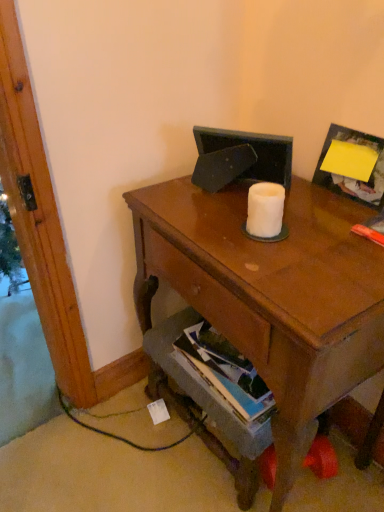
Find the location of a particular element. This screenshot has height=512, width=384. hardcover book at lower center is located at coordinates (227, 377).

Where is `yellow paper at upper right`? yellow paper at upper right is located at coordinates (352, 179).

Find the location of a particular element. The height and width of the screenshot is (512, 384). white matte toilet paper at center is located at coordinates (265, 210).

Does white matte toilet paper at center appear on the right side of hardcover book at lower center?

Correct, you'll find white matte toilet paper at center to the right of hardcover book at lower center.

Is white matte toilet paper at center taller or shorter than hardcover book at lower center?

In the image, white matte toilet paper at center appears to be shorter than hardcover book at lower center.

Is white matte toilet paper at center oriented away from hardcover book at lower center?

No, hardcover book at lower center is not at the back of white matte toilet paper at center.

From a real-world perspective, is hardcover book at lower center positioned under white matte toilet paper at center based on gravity?

Indeed, from a real-world perspective, hardcover book at lower center is positioned beneath white matte toilet paper at center.

Which object is positioned more to the left, hardcover book at lower center or white matte toilet paper at center?

hardcover book at lower center is more to the left.

Is point (246, 418) positioned before point (280, 211)?

No, it is not.

Are hardcover book at lower center and white matte toilet paper at center beside each other?

No, hardcover book at lower center is not in contact with white matte toilet paper at center.

Is yellow paper at upper right further to the viewer compared to hardcover book at lower center?

No, it is not.

Between yellow paper at upper right and hardcover book at lower center, which one has larger size?

With larger size is hardcover book at lower center.

Would you say yellow paper at upper right is outside hardcover book at lower center?

yellow paper at upper right is positioned outside hardcover book at lower center.

Consider the image. From a real-world perspective, is yellow paper at upper right located higher than hardcover book at lower center?

Yes, from a real-world perspective, yellow paper at upper right is on top of hardcover book at lower center.

Is the surface of matte brown desk at center in direct contact with yellow paper at upper right?

No, matte brown desk at center is not touching yellow paper at upper right.

Between point (297, 449) and point (363, 143), which one is positioned behind?

Point (363, 143)

Is matte brown desk at center facing away from yellow paper at upper right?

matte brown desk at center does not have its back to yellow paper at upper right.

You are a GUI agent. You are given a task and a screenshot of the screen. Output one action in this format:
    pyautogui.click(x=<x>, y=<y>)
    Task: Click on the picture frame lying above the matte brown desk at center (from the image's perspective)
    This screenshot has width=384, height=512.
    Given the screenshot: What is the action you would take?
    pyautogui.click(x=352, y=179)

Is point (268, 216) closer or farther from the camera than point (337, 130)?

Clearly, point (268, 216) is closer to the camera than point (337, 130).

From a real-world perspective, which is physically above, white matte toilet paper at center or yellow paper at upper right?

yellow paper at upper right is physically above.

Is white matte toilet paper at center facing towards yellow paper at upper right?

No, white matte toilet paper at center is not oriented towards yellow paper at upper right.

From a real-world perspective, is hardcover book at lower center above or below matte brown desk at center?

From a real-world perspective, hardcover book at lower center is physically above matte brown desk at center.

In the scene shown: Can you tell me how much hardcover book at lower center and matte brown desk at center differ in facing direction?

3.65 degrees separate the facing orientations of hardcover book at lower center and matte brown desk at center.

Is the surface of hardcover book at lower center in direct contact with matte brown desk at center?

No, hardcover book at lower center is not beside matte brown desk at center.

This screenshot has height=512, width=384. What are the coordinates of `desk lying on the right of hardcover book at lower center` in the screenshot? It's located at (271, 294).

From the image's perspective, is yellow paper at upper right located above or below white matte toilet paper at center?

yellow paper at upper right is situated higher than white matte toilet paper at center in the image.

Can you confirm if yellow paper at upper right is taller than white matte toilet paper at center?

Yes, yellow paper at upper right is taller than white matte toilet paper at center.

In the scene shown: How many degrees apart are the facing directions of yellow paper at upper right and white matte toilet paper at center?

yellow paper at upper right and white matte toilet paper at center are facing 0.492 degrees away from each other.

The width and height of the screenshot is (384, 512). What are the coordinates of `book that is under the white matte toilet paper at center (from a real-world perspective)` in the screenshot? It's located at (227, 377).

Locate an element on the screen. This screenshot has height=512, width=384. book that appears behind the white matte toilet paper at center is located at coordinates (227, 377).

From the image, which object appears to be nearer to yellow paper at upper right, white matte toilet paper at center or hardcover book at lower center?

white matte toilet paper at center is positioned closer to the anchor yellow paper at upper right.

Considering their positions, is white matte toilet paper at center positioned further to matte brown desk at center than hardcover book at lower center?

The object further to matte brown desk at center is hardcover book at lower center.

From the image, which object appears to be farther from hardcover book at lower center, matte brown desk at center or yellow paper at upper right?

The object further to hardcover book at lower center is yellow paper at upper right.

Which object lies further to the anchor point hardcover book at lower center, yellow paper at upper right or white matte toilet paper at center?

Based on the image, yellow paper at upper right appears to be further to hardcover book at lower center.

In the scene shown: Estimate the real-world distances between objects in this image. Which object is further from matte brown desk at center, yellow paper at upper right or hardcover book at lower center?

yellow paper at upper right is positioned further to the anchor matte brown desk at center.

When comparing their distances from hardcover book at lower center, does white matte toilet paper at center or matte brown desk at center seem further?

Based on the image, white matte toilet paper at center appears to be further to hardcover book at lower center.

Looking at the image, which one is located closer to white matte toilet paper at center, matte brown desk at center or yellow paper at upper right?

matte brown desk at center is closer to white matte toilet paper at center.

Which object lies nearer to the anchor point white matte toilet paper at center, hardcover book at lower center or matte brown desk at center?

matte brown desk at center is closer to white matte toilet paper at center.

At what (x,y) coordinates should I click in order to perform the action: click on desk between yellow paper at upper right and hardcover book at lower center in the vertical direction. Please return your answer as a coordinate pair (x, y). This screenshot has width=384, height=512. Looking at the image, I should click on (271, 294).

You are a GUI agent. You are given a task and a screenshot of the screen. Output one action in this format:
    pyautogui.click(x=<x>, y=<y>)
    Task: Click on the desk between white matte toilet paper at center and hardcover book at lower center vertically
    This screenshot has height=512, width=384.
    Given the screenshot: What is the action you would take?
    pyautogui.click(x=271, y=294)

The width and height of the screenshot is (384, 512). Find the location of `toilet paper between yellow paper at upper right and hardcover book at lower center in the up-down direction`. toilet paper between yellow paper at upper right and hardcover book at lower center in the up-down direction is located at coordinates click(265, 210).

At what (x,y) coordinates should I click in order to perform the action: click on toilet paper between yellow paper at upper right and matte brown desk at center in the vertical direction. Please return your answer as a coordinate pair (x, y). This screenshot has width=384, height=512. Looking at the image, I should click on (265, 210).